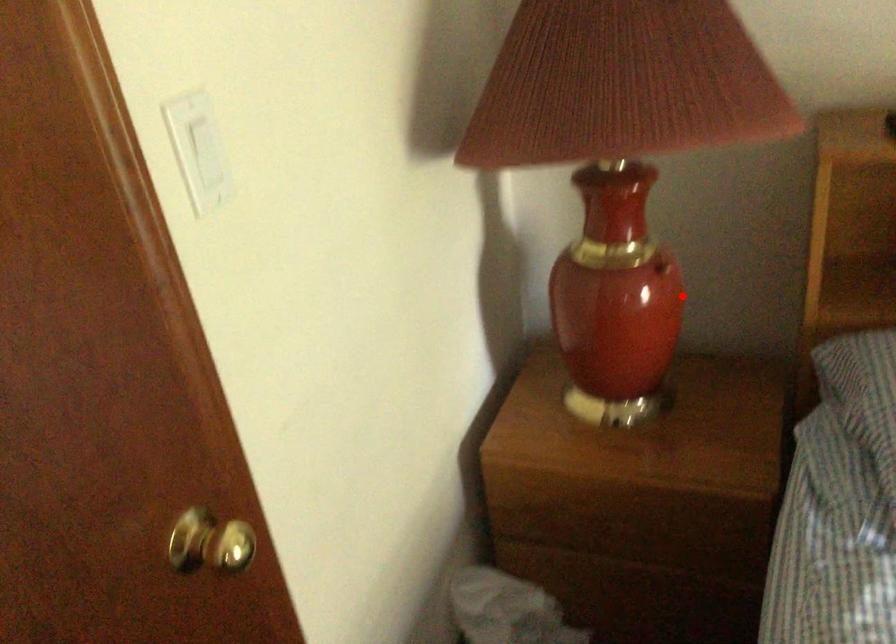
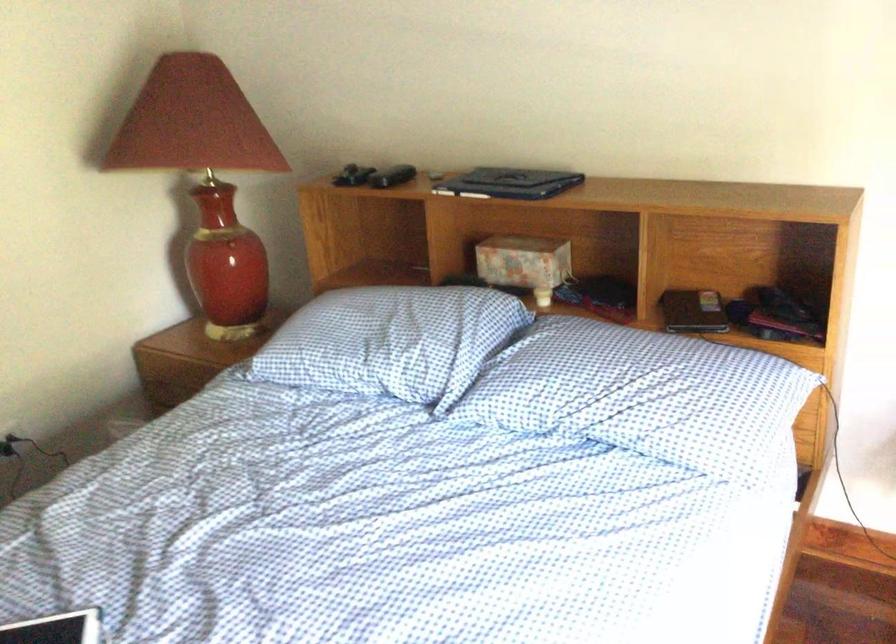
Find the pixel in the second image that matches the highlighted location in the first image.

(229, 249)